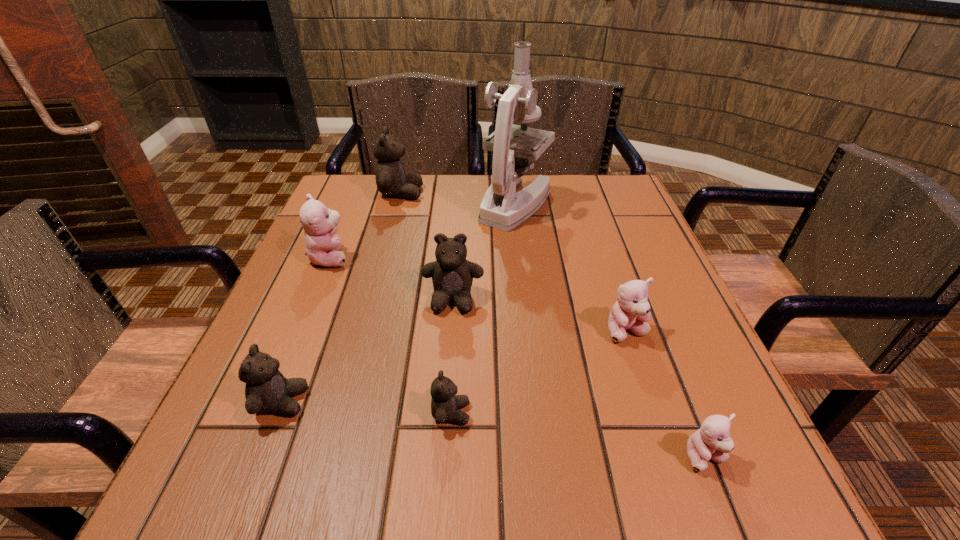
Identify the location of free space at the far left corner of the desktop. (353, 193).

Identify the location of vacant position at the far right corner of the desktop. (600, 178).

The image size is (960, 540). What are the coordinates of `free space at the near right corner of the desktop` in the screenshot? It's located at (680, 464).

Locate an element on the screen. The image size is (960, 540). empty location between the fifth teddy bear from right to left and the microscope is located at coordinates (458, 199).

I want to click on free space that is in between the third smallest brown teddy bear and the third biggest brown teddy bear, so click(368, 350).

At what (x,y) coordinates should I click in order to perform the action: click on vacant area between the seventh shortest object and the fourth farthest teddy bear. Please return your answer as a coordinate pair (x, y). Image resolution: width=960 pixels, height=540 pixels. Looking at the image, I should click on (514, 262).

Locate an element on the screen. The width and height of the screenshot is (960, 540). vacant space in between the fourth farthest object and the smallest brown teddy bear is located at coordinates (452, 356).

The height and width of the screenshot is (540, 960). In order to click on vacant region between the seventh shortest object and the leftmost brown teddy bear in this screenshot , I will do `click(342, 297)`.

Identify the location of vacant area that lies between the third nearest brown teddy bear and the smallest brown teddy bear. The width and height of the screenshot is (960, 540). (452, 356).

Find the location of `free space between the second nearest pink teddy bear and the second smallest brown teddy bear`. free space between the second nearest pink teddy bear and the second smallest brown teddy bear is located at coordinates (454, 367).